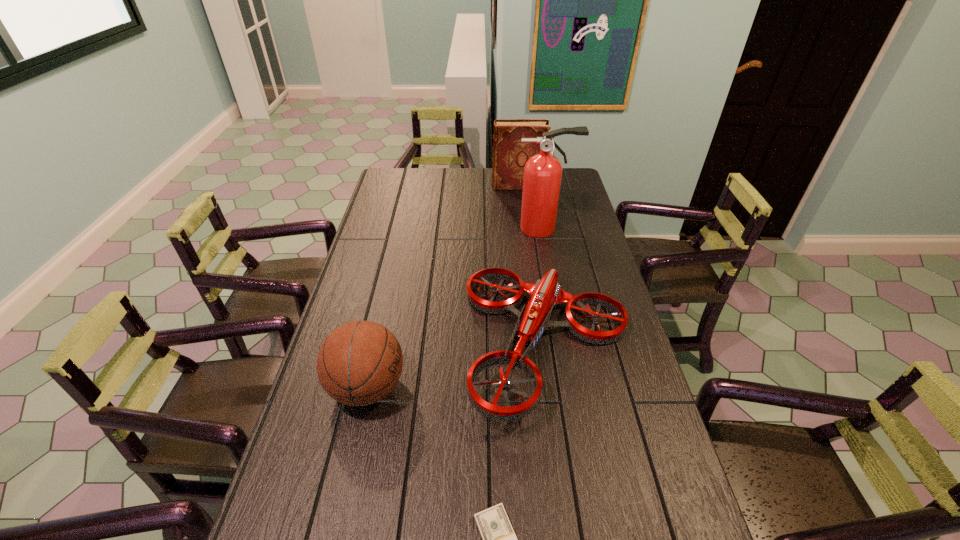
This screenshot has height=540, width=960. What are the coordinates of `vacant space at the right edge of the desktop` in the screenshot? It's located at click(x=615, y=369).

Locate an element on the screen. The width and height of the screenshot is (960, 540). free spot at the far left corner of the desktop is located at coordinates (411, 176).

At what (x,y) coordinates should I click in order to perform the action: click on free space between the farthest object and the drone. Please return your answer as a coordinate pair (x, y). This screenshot has width=960, height=540. Looking at the image, I should click on (533, 265).

Identify the location of vacant space that's between the leftmost object and the fourth shortest object. Image resolution: width=960 pixels, height=540 pixels. (443, 287).

At what (x,y) coordinates should I click in order to perform the action: click on free spot between the second tallest object and the leftmost object. Please return your answer as a coordinate pair (x, y). This screenshot has height=540, width=960. Looking at the image, I should click on (443, 287).

You are a GUI agent. You are given a task and a screenshot of the screen. Output one action in this format:
    pyautogui.click(x=<x>, y=<y>)
    Task: Click on the vacant space in between the fourth shortest object and the fourth tallest object
    The height and width of the screenshot is (540, 960).
    Given the screenshot: What is the action you would take?
    pyautogui.click(x=533, y=265)

Locate which object is the closest to the tallest object. Please provide its 2D coordinates. Your answer should be formatted as a tuple, i.e. [(x, y)], where the tuple contains the x and y coordinates of a point satisfying the conditions above.

[(510, 154)]

Find the location of a particular element. object that is the fourth closest to the leftmost object is located at coordinates (510, 154).

Identify the location of free space that satisfies the following two spatial constraints: 1. on the back side of the drone; 2. on the left side of the fire extinguisher. (531, 228).

This screenshot has width=960, height=540. Identify the location of free space that satisfies the following two spatial constraints: 1. on the spine side of the hardback book; 2. on the left side of the second farthest object. (523, 228).